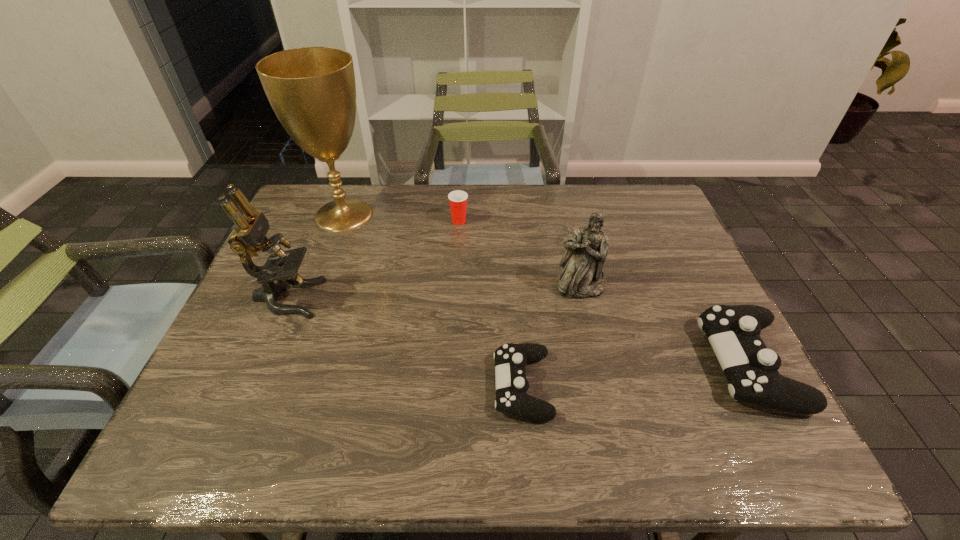
At what (x,y) coordinates should I click in order to perform the action: click on Dixie cup located in the far edge section of the desktop. Please return your answer as a coordinate pair (x, y). Looking at the image, I should click on (458, 199).

Where is `trophy cup positioned at the left edge`? trophy cup positioned at the left edge is located at coordinates (312, 90).

In order to click on microscope that is at the left edge in this screenshot , I will do `click(249, 237)`.

Where is `object located in the right edge section of the desktop`? object located in the right edge section of the desktop is located at coordinates (751, 369).

This screenshot has height=540, width=960. I want to click on object that is at the far left corner, so click(312, 90).

Where is `object that is positioned at the near right corner`? object that is positioned at the near right corner is located at coordinates (751, 369).

Where is `vacant space at the far edge of the desktop`? The height and width of the screenshot is (540, 960). vacant space at the far edge of the desktop is located at coordinates (478, 205).

At what (x,y) coordinates should I click in order to perform the action: click on vacant area at the near edge of the desktop. Please return your answer as a coordinate pair (x, y). The height and width of the screenshot is (540, 960). Looking at the image, I should click on (365, 389).

This screenshot has width=960, height=540. In order to click on free space at the left edge of the desktop in this screenshot , I will do `click(308, 273)`.

In the image, there is a desktop. Where is `vacant space at the right edge`? This screenshot has height=540, width=960. vacant space at the right edge is located at coordinates (673, 329).